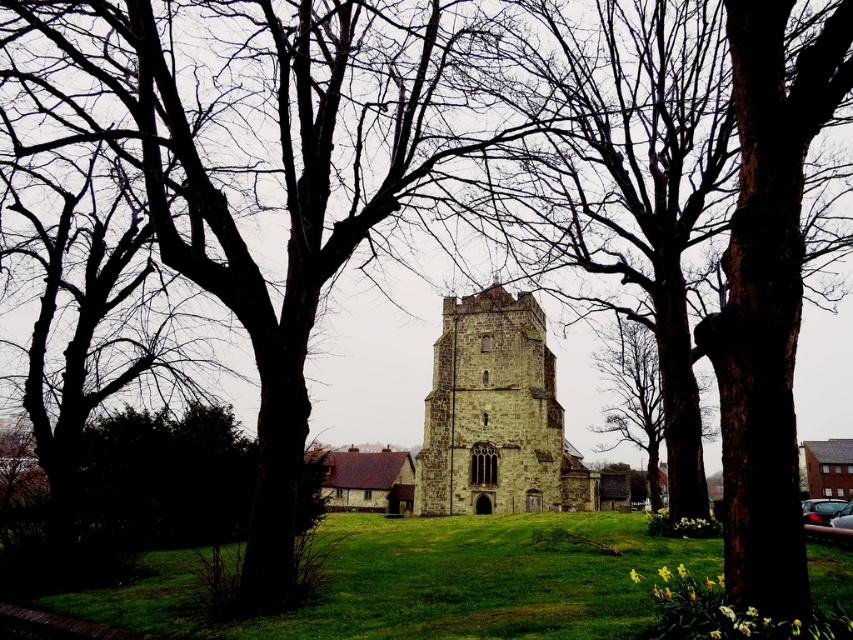
Which is behind, point (457, 609) or point (666, 384)?

The point (666, 384) is more distant.

Is green grassy field at center below brown rough bark tree at center?

Correct, green grassy field at center is located below brown rough bark tree at center.

Where is `green grassy field at center`? The height and width of the screenshot is (640, 853). green grassy field at center is located at coordinates (483, 579).

Does green grassy field at center have a larger size compared to stone tower at center?

Actually, green grassy field at center might be smaller than stone tower at center.

Is point (387, 529) closer to camera compared to point (514, 413)?

Yes, it is.

The image size is (853, 640). What are the coordinates of `green grassy field at center` in the screenshot? It's located at (483, 579).

Does stone tower at center appear over brown rough bark tree at center?

Incorrect, stone tower at center is not positioned above brown rough bark tree at center.

Between point (550, 381) and point (671, 458), which one is positioned behind?

Positioned behind is point (550, 381).

Identify the location of stone tower at center. (496, 416).